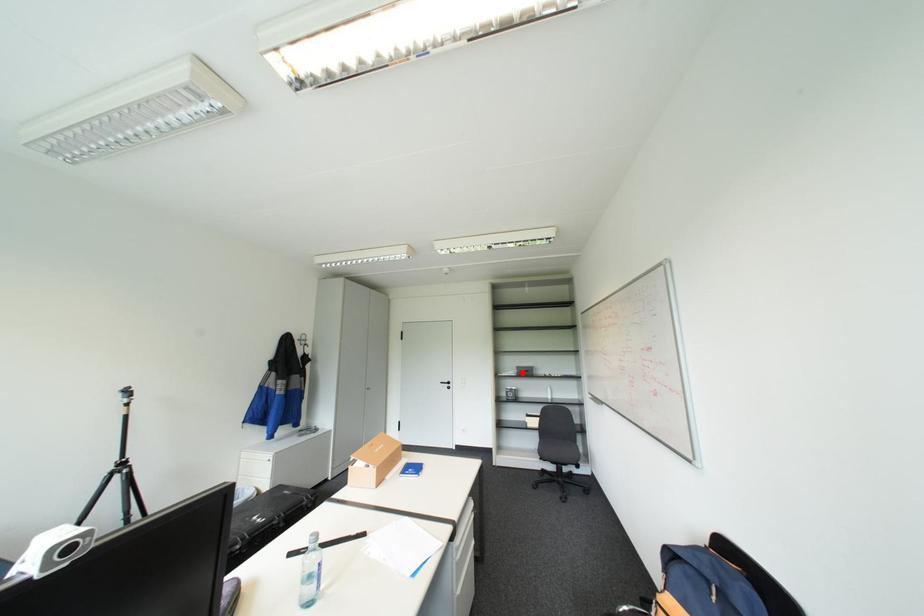
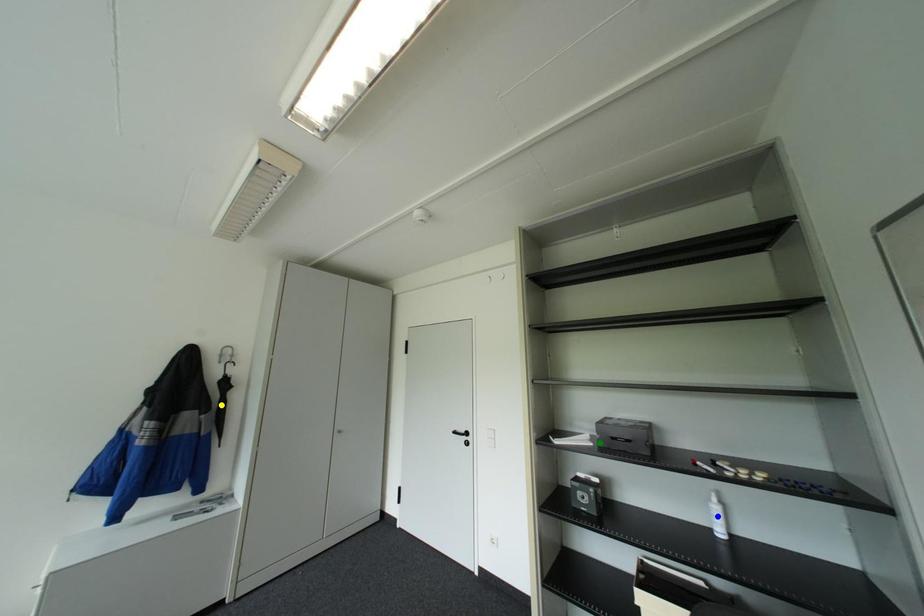
Question: I am providing you with two images of the same scene from different viewpoints. A red point is marked on the first image. You are given multiple points on the second image. Which spot in image 2 lines up with the point in image 1?

Choices:
 (A) blue point
 (B) green point
 (C) yellow point

Answer: (B)